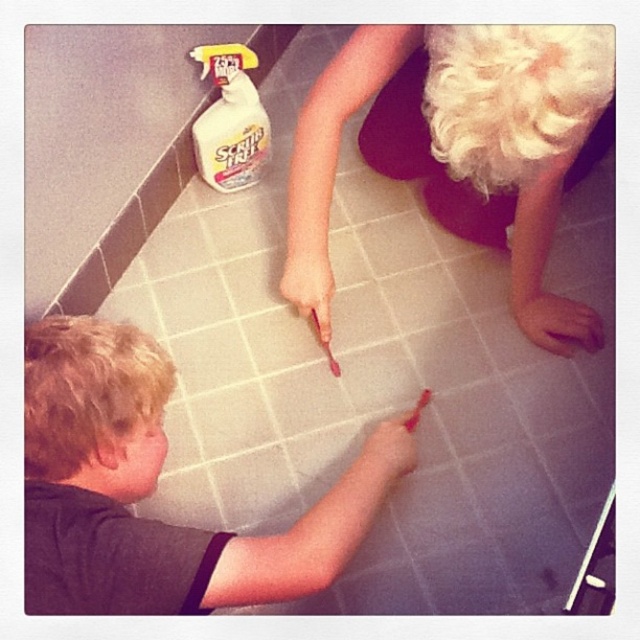
Is pink matte hand at lower right positioned in front of pink matte finger at center?

That is True.

Is pink matte hand at lower right to the right of pink matte finger at center from the viewer's perspective?

Indeed, pink matte hand at lower right is positioned on the right side of pink matte finger at center.

I want to click on pink matte hand at lower right, so click(x=554, y=320).

Is point (316, 193) positioned in front of point (552, 346)?

Yes.

Which is below, blonde hair wig at upper right or pink matte hand at lower right?

pink matte hand at lower right is lower down.

Is point (333, 150) farther from camera compared to point (563, 307)?

No.

This screenshot has height=640, width=640. In order to click on blonde hair wig at upper right in this screenshot , I will do `click(337, 120)`.

Is point (292, 291) positioned in front of point (419, 401)?

Yes, point (292, 291) is in front of point (419, 401).

Which is above, pink matte finger at center or pink matte crayon at center?

pink matte finger at center is higher up.

Does point (323, 272) come closer to viewer compared to point (428, 390)?

Yes, it is in front of point (428, 390).

The height and width of the screenshot is (640, 640). I want to click on pink matte finger at center, so click(308, 282).